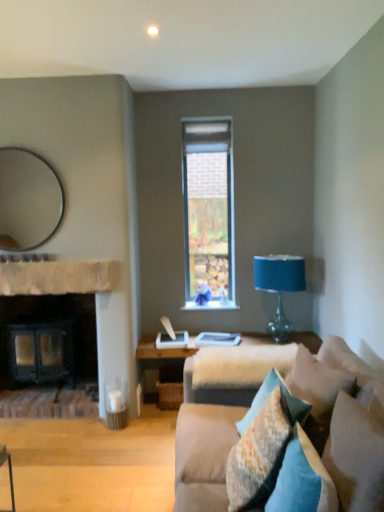
At what (x,y) coordinates should I click in order to perform the action: click on velvet beige couch at lower right. Please return your answer as a coordinate pair (x, y). Image resolution: width=384 pixels, height=512 pixels. Looking at the image, I should click on (x=295, y=438).

Identify the location of velvet teal pillow at lower right, the first pillow viewed from the front. (355, 456).

Measure the distance between textured blue pillow at lower right, acting as the fourth pillow starting from the front, and camera.

textured blue pillow at lower right, acting as the fourth pillow starting from the front, and camera are 1.94 meters apart.

Where is `textured beige pillow at lower right, placed as the second pillow when sorted from back to front`? Image resolution: width=384 pixels, height=512 pixels. textured beige pillow at lower right, placed as the second pillow when sorted from back to front is located at coordinates (x=262, y=450).

Does textured beige pillow at lower right, marked as the 3th pillow in a front-to-back arrangement, have a lesser height compared to matte silver mirror at upper left?

Yes.

Is textured beige pillow at lower right, placed as the second pillow when sorted from back to front, smaller than matte silver mirror at upper left?

Incorrect, textured beige pillow at lower right, placed as the second pillow when sorted from back to front, is not smaller in size than matte silver mirror at upper left.

From the image's perspective, which is below, textured beige pillow at lower right, marked as the 3th pillow in a front-to-back arrangement, or matte silver mirror at upper left?

textured beige pillow at lower right, marked as the 3th pillow in a front-to-back arrangement, is shown below in the image.

Where is `the 1st pillow counting from the right of the matte silver mirror at upper left`? This screenshot has width=384, height=512. the 1st pillow counting from the right of the matte silver mirror at upper left is located at coordinates (262, 450).

Is dark wood fireplace at left far from textured beige pillow at lower right, placed as the second pillow when sorted from back to front?

Indeed, dark wood fireplace at left is not near textured beige pillow at lower right, placed as the second pillow when sorted from back to front.

Does dark wood fireplace at left have a lesser width compared to textured beige pillow at lower right, marked as the 3th pillow in a front-to-back arrangement?

Incorrect, the width of dark wood fireplace at left is not less than that of textured beige pillow at lower right, marked as the 3th pillow in a front-to-back arrangement.

The image size is (384, 512). I want to click on the 2nd pillow in front of the dark wood fireplace at left, counting from the anchor's position, so click(262, 450).

From the image's perspective, which is above, dark wood fireplace at left or textured beige pillow at lower right, marked as the 3th pillow in a front-to-back arrangement?

dark wood fireplace at left is shown above in the image.

Is blue glass table lamp at right to the left or to the right of velvet blue pillow at lower right, which is the 3th pillow from back to front, in the image?

From the image, it's evident that blue glass table lamp at right is to the right of velvet blue pillow at lower right, which is the 3th pillow from back to front.

Does blue glass table lamp at right turn towards velvet blue pillow at lower right, positioned as the 2th pillow in front-to-back order?

Yes, blue glass table lamp at right is facing velvet blue pillow at lower right, positioned as the 2th pillow in front-to-back order.

Does blue glass table lamp at right have a smaller size compared to velvet blue pillow at lower right, which is the 3th pillow from back to front?

Incorrect, blue glass table lamp at right is not smaller in size than velvet blue pillow at lower right, which is the 3th pillow from back to front.

Is velvet blue pillow at lower right, positioned as the 2th pillow in front-to-back order, smaller than velvet beige couch at lower right?

Yes, velvet blue pillow at lower right, positioned as the 2th pillow in front-to-back order, is smaller than velvet beige couch at lower right.

From the image's perspective, which object appears higher, velvet blue pillow at lower right, which is the 3th pillow from back to front, or velvet beige couch at lower right?

velvet blue pillow at lower right, which is the 3th pillow from back to front, is shown above in the image.

Which object is positioned more to the left, velvet blue pillow at lower right, which is the 3th pillow from back to front, or velvet beige couch at lower right?

From the viewer's perspective, velvet blue pillow at lower right, which is the 3th pillow from back to front, appears more on the left side.

Is velvet blue pillow at lower right, which is the 3th pillow from back to front, inside the boundaries of velvet beige couch at lower right, or outside?

velvet blue pillow at lower right, which is the 3th pillow from back to front, is contained in velvet beige couch at lower right.

From a real-world perspective, is velvet blue pillow at lower right, which is the 3th pillow from back to front, positioned over velvet teal pillow at lower right, which is counted as the 4th pillow, starting from the back, based on gravity?

Incorrect, from a real-world perspective, velvet blue pillow at lower right, which is the 3th pillow from back to front, is lower than velvet teal pillow at lower right, which is counted as the 4th pillow, starting from the back.

From their relative heights in the image, would you say velvet blue pillow at lower right, which is the 3th pillow from back to front, is taller or shorter than velvet teal pillow at lower right, which is counted as the 4th pillow, starting from the back?

Clearly, velvet blue pillow at lower right, which is the 3th pillow from back to front, is shorter compared to velvet teal pillow at lower right, which is counted as the 4th pillow, starting from the back.

Is velvet blue pillow at lower right, which is the 3th pillow from back to front, not within velvet teal pillow at lower right, the first pillow viewed from the front?

Absolutely, velvet blue pillow at lower right, which is the 3th pillow from back to front, is external to velvet teal pillow at lower right, the first pillow viewed from the front.

Is velvet blue pillow at lower right, which is the 3th pillow from back to front, far from velvet teal pillow at lower right, the first pillow viewed from the front?

No, there isn't a large distance between velvet blue pillow at lower right, which is the 3th pillow from back to front, and velvet teal pillow at lower right, the first pillow viewed from the front.

From the picture: Considering the sizes of objects velvet teal pillow at lower right, which is counted as the 4th pillow, starting from the back, and dark wood fireplace at left in the image provided, who is taller, velvet teal pillow at lower right, which is counted as the 4th pillow, starting from the back, or dark wood fireplace at left?

With more height is dark wood fireplace at left.

Which of these two, velvet teal pillow at lower right, the first pillow viewed from the front, or dark wood fireplace at left, is thinner?

Thinner between the two is velvet teal pillow at lower right, the first pillow viewed from the front.

Considering the relative positions of velvet teal pillow at lower right, which is counted as the 4th pillow, starting from the back, and dark wood fireplace at left in the image provided, is velvet teal pillow at lower right, which is counted as the 4th pillow, starting from the back, behind dark wood fireplace at left?

No, it is not.

Is velvet teal pillow at lower right, the first pillow viewed from the front, not within dark wood fireplace at left?

Yes, velvet teal pillow at lower right, the first pillow viewed from the front, is not within dark wood fireplace at left.

From the image's perspective, is velvet beige couch at lower right on velvet teal pillow at lower right, which is counted as the 4th pillow, starting from the back?

No, from the image's perspective, velvet beige couch at lower right is not on top of velvet teal pillow at lower right, which is counted as the 4th pillow, starting from the back.

Are velvet beige couch at lower right and velvet teal pillow at lower right, the first pillow viewed from the front, far apart?

No, there isn't a large distance between velvet beige couch at lower right and velvet teal pillow at lower right, the first pillow viewed from the front.

Looking at the image, does velvet beige couch at lower right seem bigger or smaller compared to velvet teal pillow at lower right, which is counted as the 4th pillow, starting from the back?

velvet beige couch at lower right is bigger than velvet teal pillow at lower right, which is counted as the 4th pillow, starting from the back.

Identify the location of studio couch in front of the velvet teal pillow at lower right, the first pillow viewed from the front. This screenshot has width=384, height=512. (295, 438).

Where is `pillow that is the 1st object to the right of the matte silver mirror at upper left, starting at the anchor`? The height and width of the screenshot is (512, 384). pillow that is the 1st object to the right of the matte silver mirror at upper left, starting at the anchor is located at coordinates (262, 450).

Locate an element on the screen. The width and height of the screenshot is (384, 512). the 2nd pillow in front of the dark wood fireplace at left, counting from the anchor's position is located at coordinates (262, 450).

Based on their spatial positions, is brown stone fireplace at left or velvet blue pillow at lower right, positioned as the 2th pillow in front-to-back order, closer to textured blue pillow at lower right, acting as the fourth pillow starting from the front?

velvet blue pillow at lower right, positioned as the 2th pillow in front-to-back order, lies closer to textured blue pillow at lower right, acting as the fourth pillow starting from the front, than the other object.

Consider the image. Looking at the image, which one is located closer to textured beige pillow at lower right, placed as the second pillow when sorted from back to front, matte silver mirror at upper left or textured blue pillow at lower right, the 1th pillow positioned from the back?

Among the two, textured blue pillow at lower right, the 1th pillow positioned from the back, is located nearer to textured beige pillow at lower right, placed as the second pillow when sorted from back to front.

Based on their spatial positions, is textured blue pillow at lower right, acting as the fourth pillow starting from the front, or velvet beige couch at lower right further from blue glass table lamp at right?

velvet beige couch at lower right.

When comparing their distances from matte silver mirror at upper left, does beige fur at center or textured beige pillow at lower right, marked as the 3th pillow in a front-to-back arrangement, seem further?

The object further to matte silver mirror at upper left is textured beige pillow at lower right, marked as the 3th pillow in a front-to-back arrangement.

From the picture: Considering their positions, is velvet blue pillow at lower right, positioned as the 2th pillow in front-to-back order, positioned closer to textured blue pillow at lower right, the 1th pillow positioned from the back, than brown stone fireplace at left?

velvet blue pillow at lower right, positioned as the 2th pillow in front-to-back order, is positioned closer to the anchor textured blue pillow at lower right, the 1th pillow positioned from the back.

Estimate the real-world distances between objects in this image. Which object is closer to textured blue pillow at lower right, the 1th pillow positioned from the back, velvet blue pillow at lower right, positioned as the 2th pillow in front-to-back order, or beige fur at center?

beige fur at center is positioned closer to the anchor textured blue pillow at lower right, the 1th pillow positioned from the back.

Considering their positions, is velvet blue pillow at lower right, which is the 3th pillow from back to front, positioned further to blue glass table lamp at right than matte silver mirror at upper left?

velvet blue pillow at lower right, which is the 3th pillow from back to front, lies further to blue glass table lamp at right than the other object.

From the image, which object appears to be nearer to velvet blue pillow at lower right, positioned as the 2th pillow in front-to-back order, beige fur at center or velvet teal pillow at lower right, which is counted as the 4th pillow, starting from the back?

velvet teal pillow at lower right, which is counted as the 4th pillow, starting from the back, is closer to velvet blue pillow at lower right, positioned as the 2th pillow in front-to-back order.

Image resolution: width=384 pixels, height=512 pixels. I want to click on mantle between matte silver mirror at upper left and dark wood fireplace at left vertically, so click(x=58, y=277).

The width and height of the screenshot is (384, 512). I want to click on pillow between textured beige pillow at lower right, marked as the 3th pillow in a front-to-back arrangement, and beige fur at center in the front-back direction, so click(x=268, y=397).

Image resolution: width=384 pixels, height=512 pixels. I want to click on mantle between matte silver mirror at upper left and beige fur at center, so click(58, 277).

What are the coordinates of `mirror positioned between velvet teal pillow at lower right, which is counted as the 4th pillow, starting from the back, and brown stone fireplace at left from near to far` in the screenshot? It's located at (28, 200).